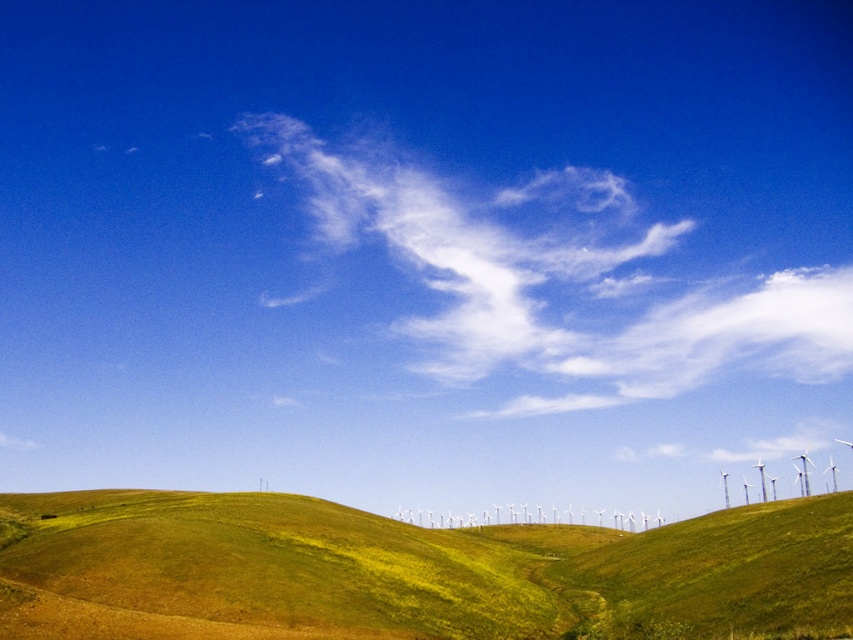
Does white cotton cloud at upper center have a greater width compared to white plastic wind turbines at center?

Correct, the width of white cotton cloud at upper center exceeds that of white plastic wind turbines at center.

At what (x,y) coordinates should I click in order to perform the action: click on white cotton cloud at upper center. Please return your answer as a coordinate pair (x, y). This screenshot has width=853, height=640. Looking at the image, I should click on (561, 282).

Between point (619, 260) and point (763, 476), which one is positioned in front?

Point (619, 260) is in front.

The image size is (853, 640). What are the coordinates of `white cotton cloud at upper center` in the screenshot? It's located at (561, 282).

Can you confirm if green grassy hillside at lower center is positioned above white cotton cloud at upper center?

Actually, green grassy hillside at lower center is below white cotton cloud at upper center.

Who is positioned more to the right, green grassy hillside at lower center or white cotton cloud at upper center?

Positioned to the right is white cotton cloud at upper center.

What do you see at coordinates (410, 572) in the screenshot? This screenshot has height=640, width=853. I see `green grassy hillside at lower center` at bounding box center [410, 572].

Where is `green grassy hillside at lower center`? The height and width of the screenshot is (640, 853). green grassy hillside at lower center is located at coordinates (410, 572).

Does green grassy hillside at lower center have a greater width compared to white plastic wind turbines at center?

No, green grassy hillside at lower center is not wider than white plastic wind turbines at center.

Does green grassy hillside at lower center appear on the right side of white plastic wind turbines at center?

No, green grassy hillside at lower center is not to the right of white plastic wind turbines at center.

This screenshot has width=853, height=640. In order to click on green grassy hillside at lower center in this screenshot , I will do `click(410, 572)`.

Find the location of `green grassy hillside at lower center`. green grassy hillside at lower center is located at coordinates (410, 572).